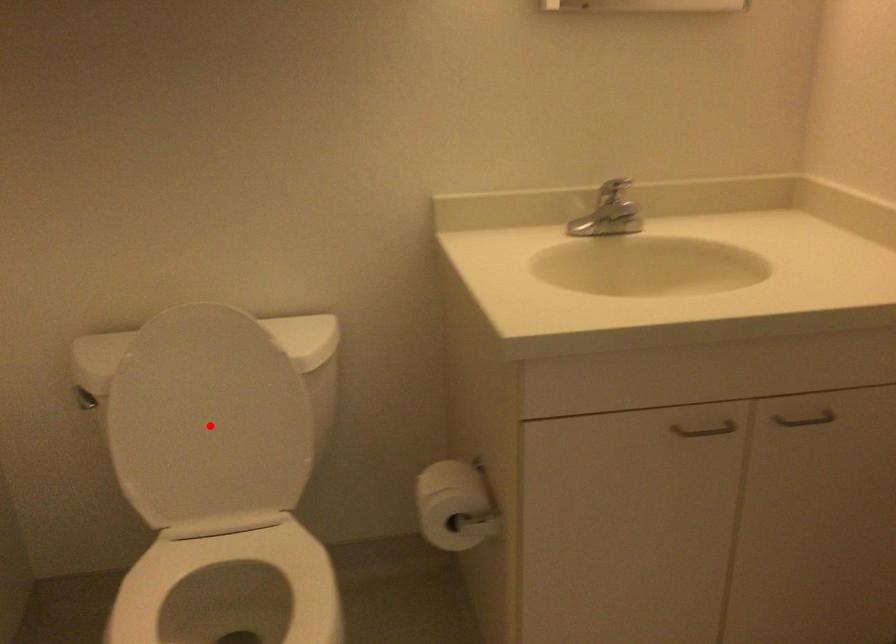
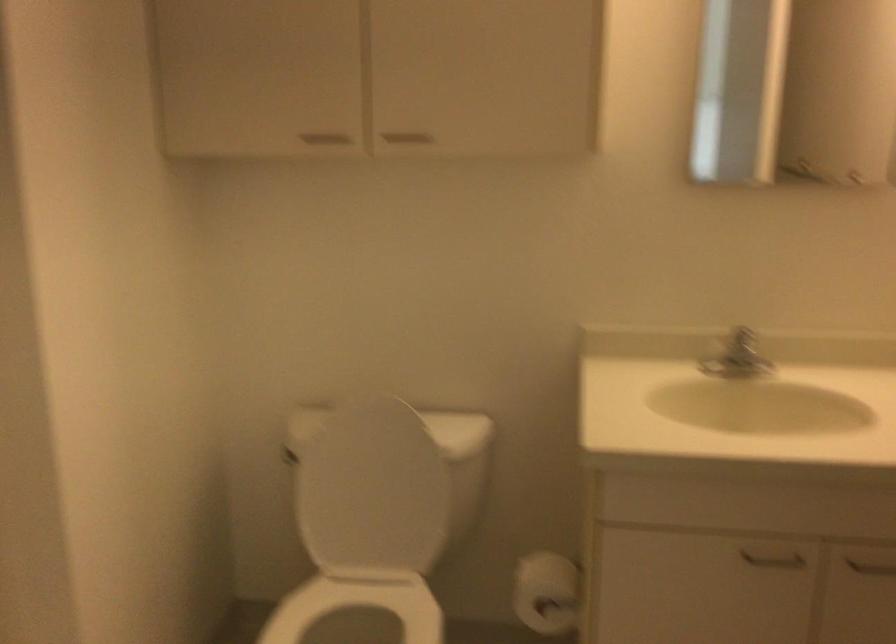
Question: A red point is marked in image1. In image2, is the corresponding 3D point closer to the camera or farther? Reply with the corresponding letter.

Choices:
 (A) The corresponding 3D point is closer.
 (B) The corresponding 3D point is farther.

Answer: (B)